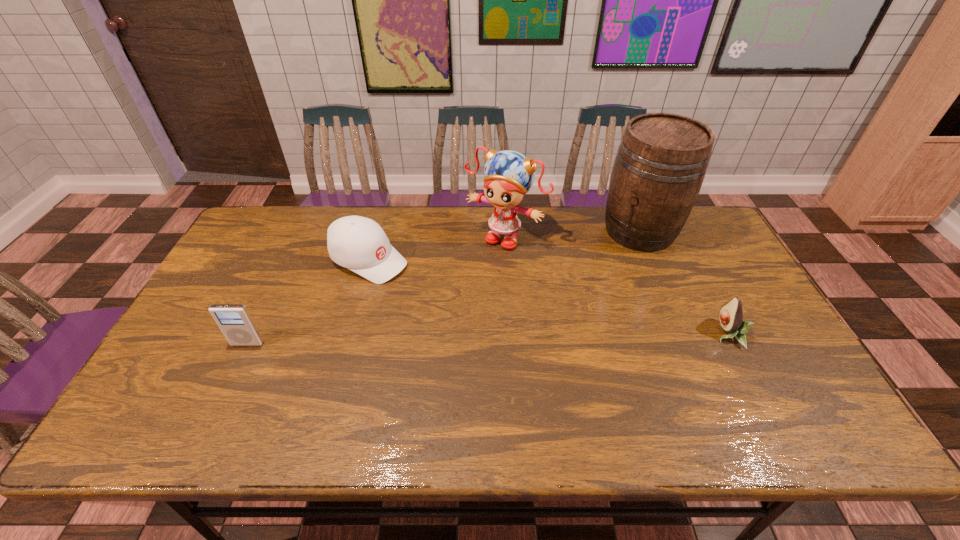
This screenshot has width=960, height=540. In order to click on vacant space on the desktop that is between the iPod and the avocado and is positioned on the face of the doll in this screenshot , I will do tap(427, 340).

I want to click on free space on the desktop that is between the leftmost object and the avocado and is positioned on the side of the cider near the bung hole, so click(x=536, y=338).

Identify the location of vacant space on the desktop that is between the iPod and the avocado and is positioned on the front-facing side of the baseball cap. The height and width of the screenshot is (540, 960). (524, 338).